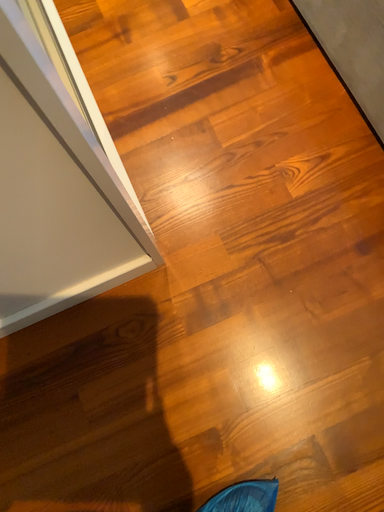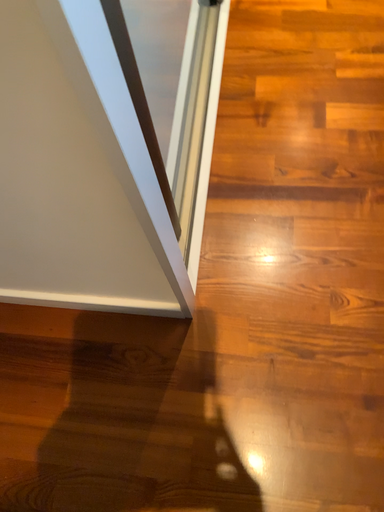
Question: Which way did the camera rotate in the video?

Choices:
 (A) rotated right
 (B) rotated left

Answer: (B)